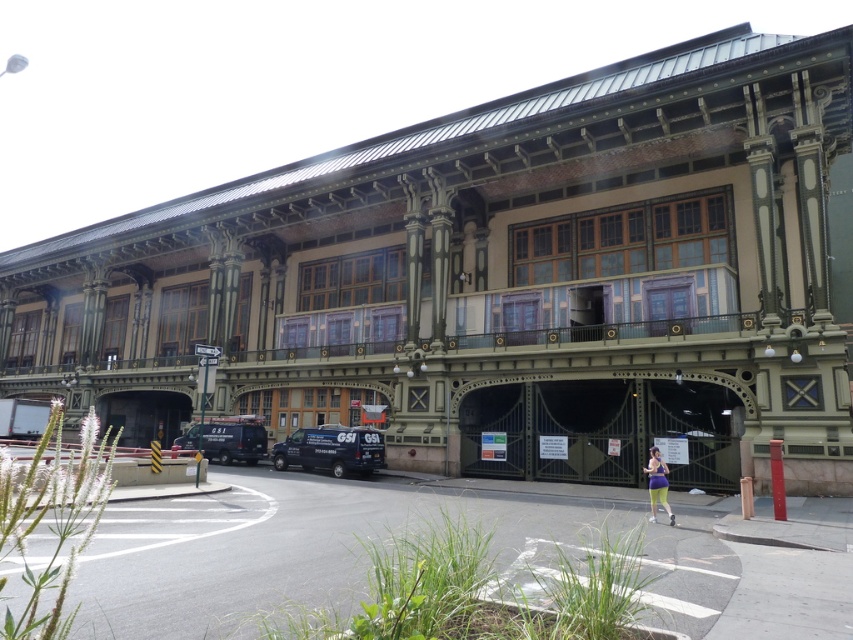
You are a delivery person arriving at this historic building and need to park your van. You see the matte black van at lower left and the red matte pillar at lower right. Which object is closer to the building, and why?

The red matte pillar at lower right is closer to the building because it is positioned behind the matte black van at lower left, meaning the pillar is nearer to the building structure compared to the van.

You are a delivery driver who needs to park your van exactly 15 meters away from the red matte pillar at lower right. You currently have the matte black van at center parked at 14.23 meters. What should you do to comply with the parking requirement?

The matte black van at center is currently 14.23 meters away from the red matte pillar at lower right. To meet the requirement of parking exactly 15 meters away, you need to move the matte black van at center approximately 0.77 meters further away from the red matte pillar at lower right.

You are a delivery driver who needs to park your 2.5m tall truck behind the matte black van at center and the matte black van at lower left. Which van should you park behind to ensure there is enough vertical clearance for your truck?

The matte black van at center is much taller as matte black van at lower left, so you should park behind the matte black van at lower left to ensure enough vertical clearance for your 2.5m tall truck.